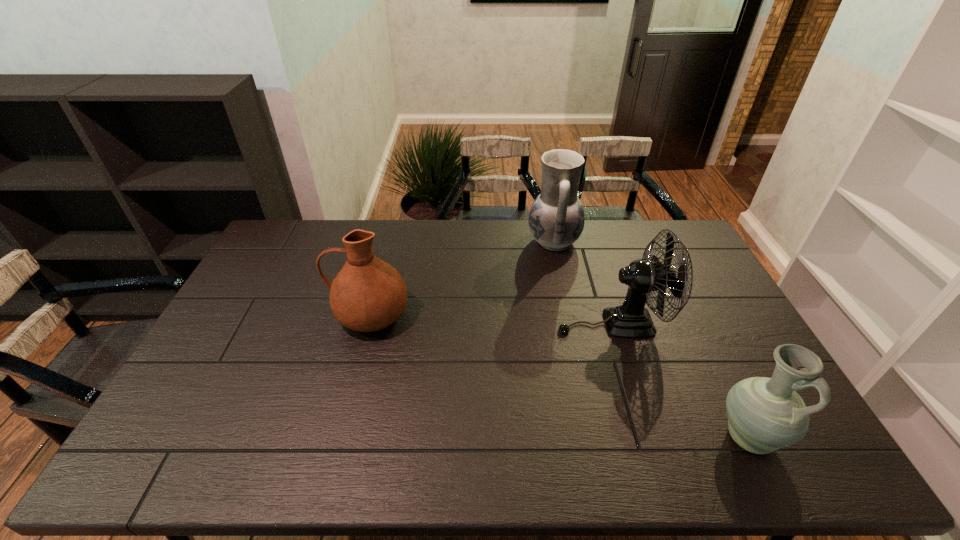
You are a GUI agent. You are given a task and a screenshot of the screen. Output one action in this format:
    pyautogui.click(x=<x>, y=<y>)
    Task: Click on the vacant space at the far edge of the desktop
    Image resolution: width=960 pixels, height=540 pixels.
    Given the screenshot: What is the action you would take?
    click(333, 239)

In order to click on free region at the near edge in this screenshot , I will do `click(355, 446)`.

I want to click on free space at the left edge of the desktop, so click(242, 303).

At what (x,y) coordinates should I click in order to perform the action: click on vacant space at the right edge of the desktop. Please return your answer as a coordinate pair (x, y). The width and height of the screenshot is (960, 540). Looking at the image, I should click on (730, 357).

Where is `vacant space at the near left corner`? This screenshot has height=540, width=960. vacant space at the near left corner is located at coordinates (197, 442).

Where is `free space between the fan and the farthest object`? free space between the fan and the farthest object is located at coordinates (583, 282).

The height and width of the screenshot is (540, 960). What are the coordinates of `vacant space that is in between the fan and the rightmost pitcher` in the screenshot? It's located at (680, 380).

Locate an element on the screen. This screenshot has height=540, width=960. free space between the nearest object and the second nearest pitcher is located at coordinates (559, 376).

Identify the location of free spot between the farthest pitcher and the nearest object. The height and width of the screenshot is (540, 960). (651, 339).

At what (x,y) coordinates should I click in order to perform the action: click on free space between the farthest object and the nearest object. Please return your answer as a coordinate pair (x, y). Looking at the image, I should click on (651, 339).